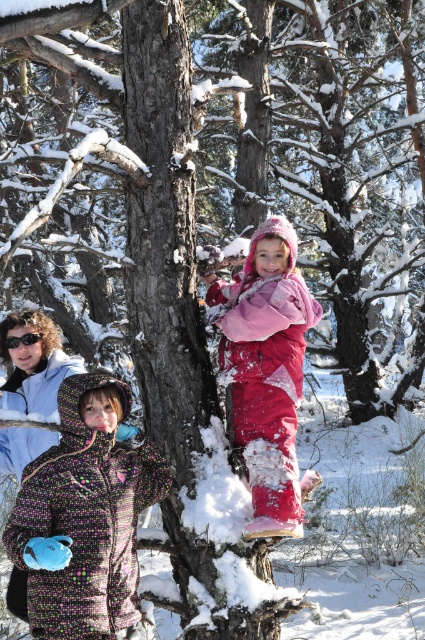
You are a photographer trying to capture a photo of the fluffy pink snowsuit at center and the black plastic goggles at upper left. Which object should you focus on first if you want to ensure both are in focus?

The fluffy pink snowsuit at center is taller than the black plastic goggles at upper left. To ensure both are in focus, you should focus on the fluffy pink snowsuit at center first since it is larger and closer to the camera.